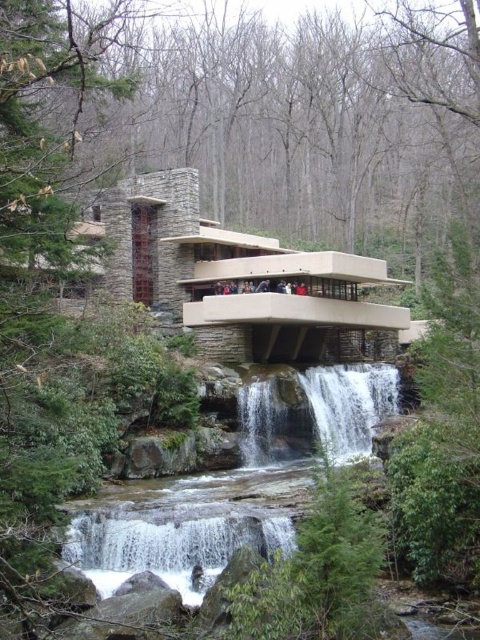
You are standing in front of the architectural structure and notice two types of water features. The first is clear water at center, and the second is white textured water at center. Which one appears nearer to you?

The clear water at center appears nearer to you because it is closer to the viewer than the white textured water at center according to the description.

You are an architect evaluating the water features in the scene. The clear water at center and the white textured water at center are both part of the same waterfall. Which one is more prominent in terms of visual presence?

The clear water at center is larger in size than the white textured water at center, making it more prominent in visual presence.